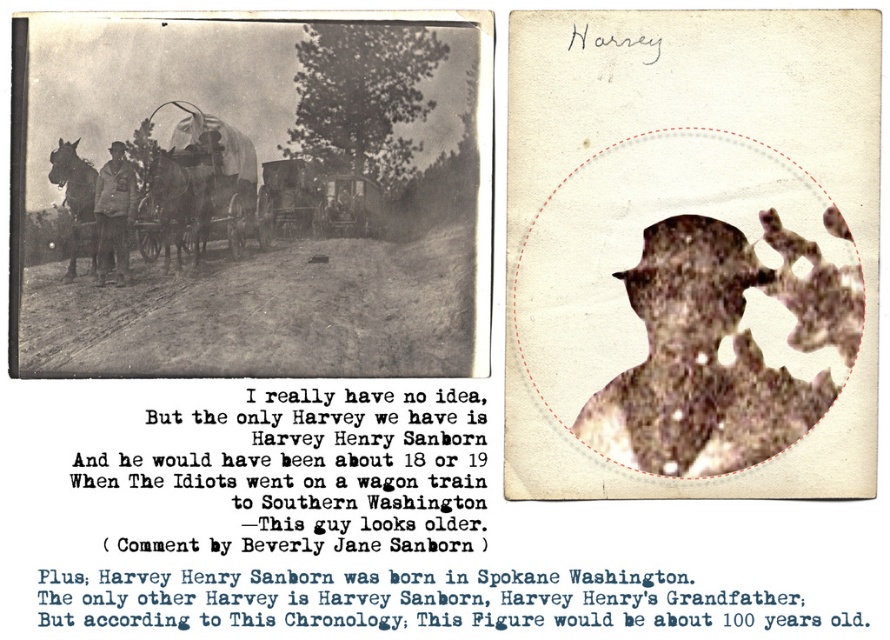
Who is taller, white canvas wagon at center or dark brown leather horse at left?

Standing taller between the two is white canvas wagon at center.

Is point (150, 154) behind point (53, 163)?

Yes.

Locate an element on the screen. This screenshot has height=640, width=890. white canvas wagon at center is located at coordinates (201, 182).

Can you confirm if brown leather horse at center is thinner than dark brown leather horse at left?

No.

Is brown leather horse at center further to the viewer compared to dark brown leather horse at left?

Yes, brown leather horse at center is behind dark brown leather horse at left.

What do you see at coordinates (181, 202) in the screenshot? This screenshot has height=640, width=890. I see `brown leather horse at center` at bounding box center [181, 202].

You are a GUI agent. You are given a task and a screenshot of the screen. Output one action in this format:
    pyautogui.click(x=<x>, y=<y>)
    Task: Click on the brown leather horse at center
    Image resolution: width=890 pixels, height=640 pixels.
    Given the screenshot: What is the action you would take?
    pyautogui.click(x=181, y=202)

Which is more to the left, brown leather horse at center or matte brown leather jacket at center?

Positioned to the left is matte brown leather jacket at center.

Is brown leather horse at center above matte brown leather jacket at center?

Correct, brown leather horse at center is located above matte brown leather jacket at center.

What do you see at coordinates (181, 202) in the screenshot? Image resolution: width=890 pixels, height=640 pixels. I see `brown leather horse at center` at bounding box center [181, 202].

This screenshot has height=640, width=890. Find the location of `brown leather horse at center`. brown leather horse at center is located at coordinates (181, 202).